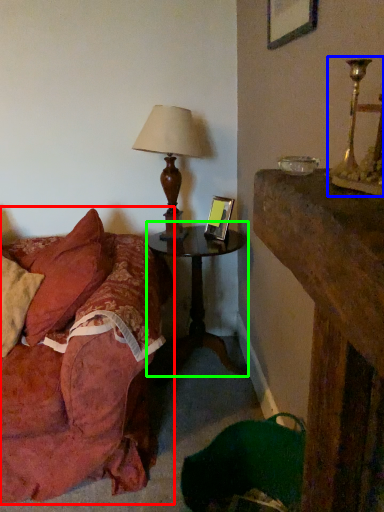
Question: Which is nearer to the studio couch (highlighted by a red box)? candle holder (highlighted by a blue box) or nightstand (highlighted by a green box).

Choices:
 (A) candle holder
 (B) nightstand

Answer: (B)